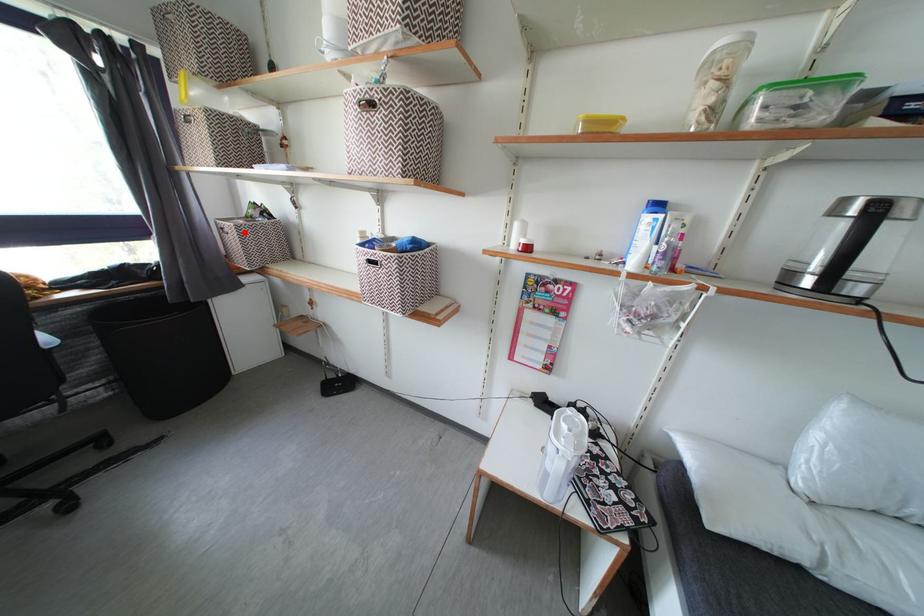
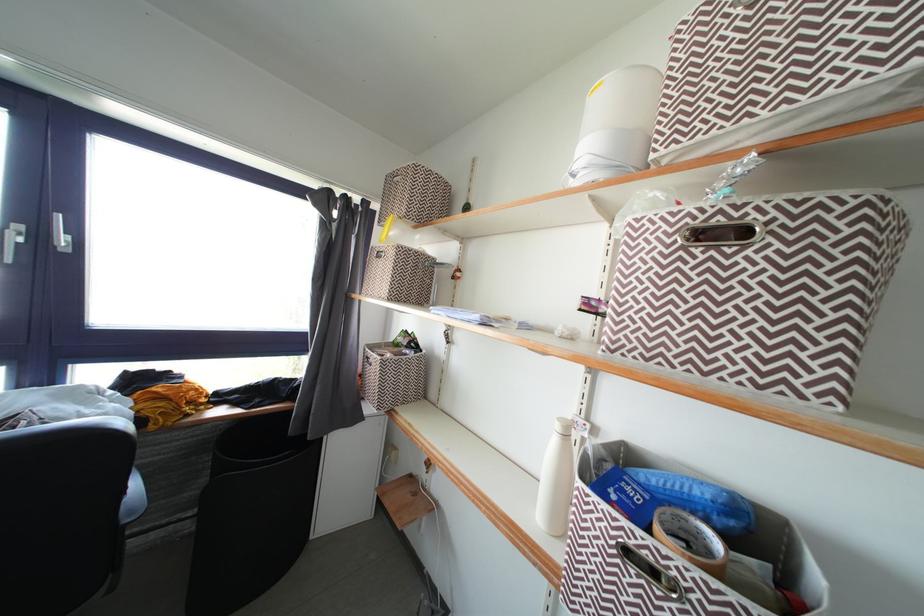
Locate, in the second image, the point that corresponds to the highlighted location in the first image.

(390, 367)